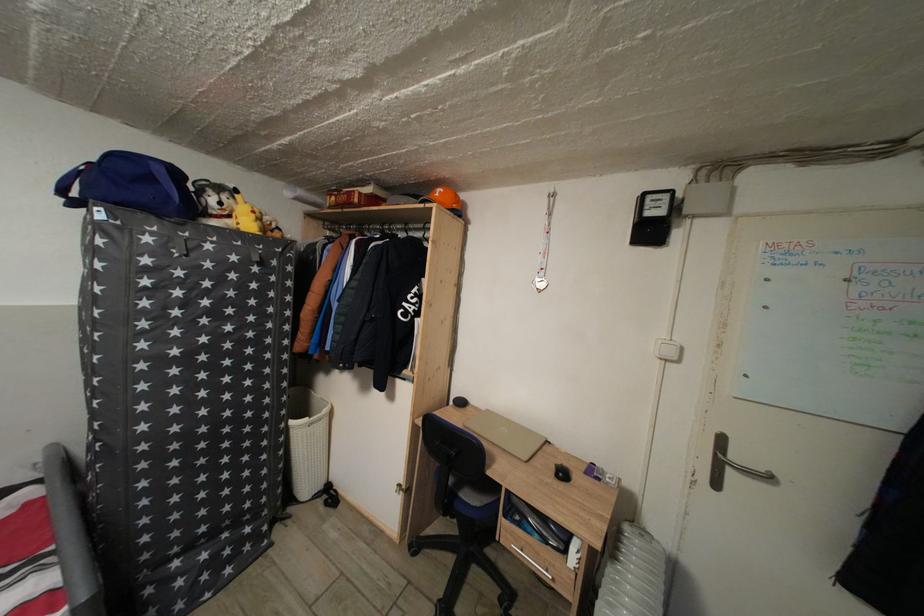
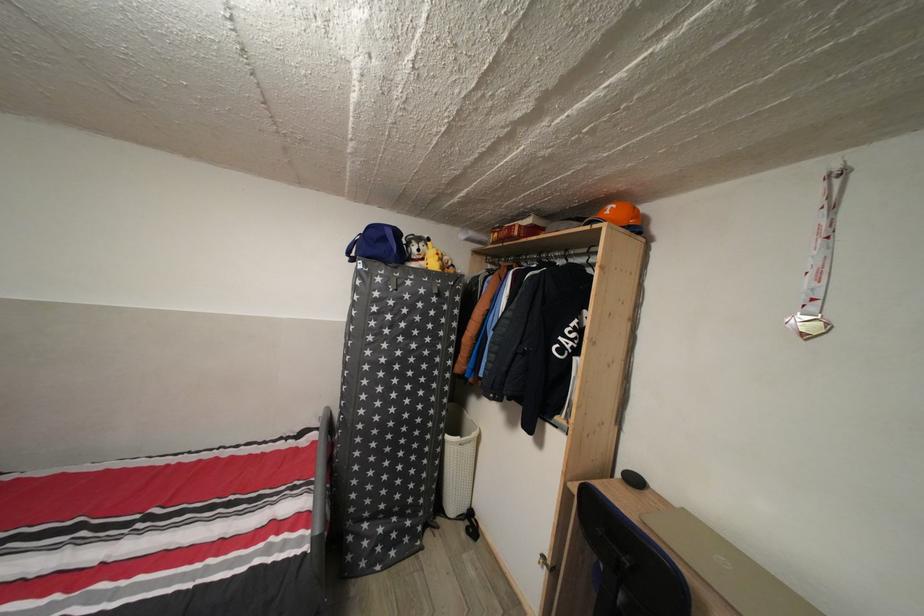
Where in the second image is the point corresponding to (x=180, y=469) from the first image?

(380, 451)